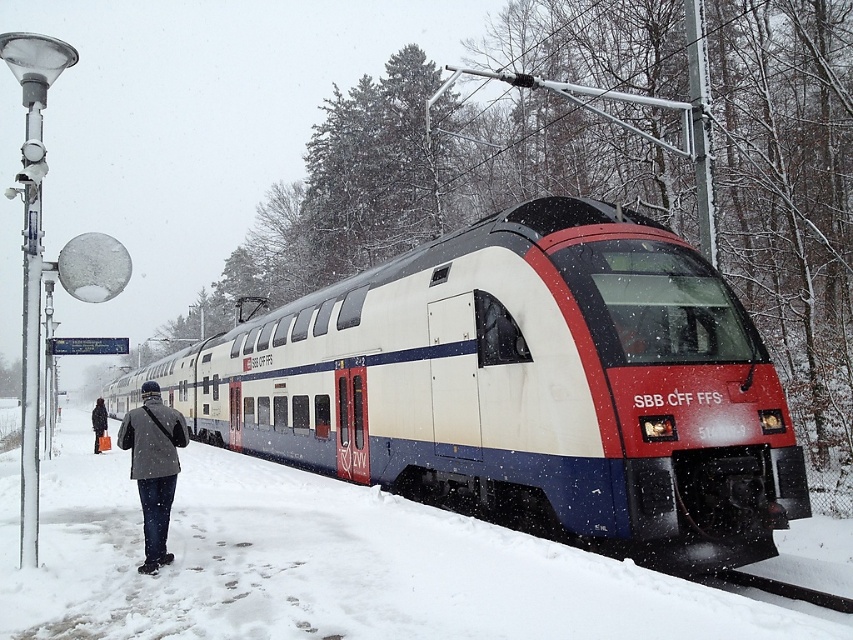
Question: Can you confirm if white glossy train at center is wider than gray woolen coat at left?

Choices:
 (A) no
 (B) yes

Answer: (B)

Question: Which of the following is the closest to the observer?

Choices:
 (A) (303, 401)
 (B) (102, 435)

Answer: (A)

Question: Does white glossy train at center have a larger size compared to gray woolen coat at left?

Choices:
 (A) no
 (B) yes

Answer: (B)

Question: Is white glossy train at center to the right of dark gray wool coat at left from the viewer's perspective?

Choices:
 (A) yes
 (B) no

Answer: (A)

Question: Which object is the farthest from the gray woolen coat at left?

Choices:
 (A) white glossy train at center
 (B) dark gray wool coat at left

Answer: (B)

Question: Which object is positioned closest to the white glossy train at center?

Choices:
 (A) gray woolen coat at left
 (B) dark gray wool coat at left

Answer: (A)